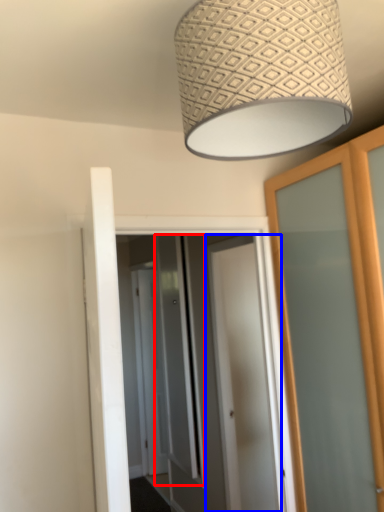
Question: Which of the following is the farthest to the observer, screen door (highlighted by a red box) or door (highlighted by a blue box)?

Choices:
 (A) screen door
 (B) door

Answer: (A)